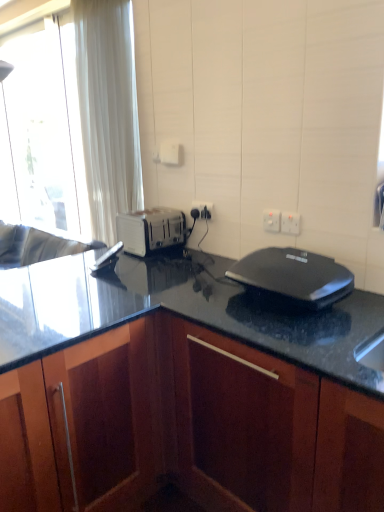
This screenshot has width=384, height=512. What are the coordinates of `empty space that is ontop of dark wood cabinet at center (from a real-world perspective)` in the screenshot? It's located at (203, 289).